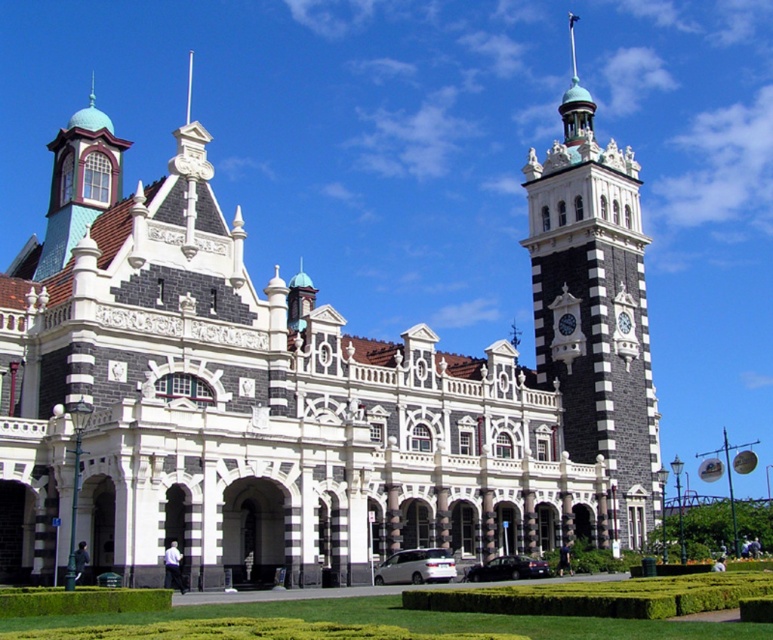
Question: Based on their relative distances, which object is nearer to the dark gray stone clock tower at center-right?

Choices:
 (A) white stone building at center
 (B) black glossy sedan at center

Answer: (B)

Question: Does white stone building at center appear under black glossy sedan at center?

Choices:
 (A) no
 (B) yes

Answer: (A)

Question: Which of these objects is positioned farthest from the white stone building at center?

Choices:
 (A) polished brass clock at center-right
 (B) white matte van at center

Answer: (A)

Question: Among these objects, which one is farthest from the camera?

Choices:
 (A) white matte van at center
 (B) polished brass clock at center-right
 (C) dark gray stone clock tower at upper right

Answer: (B)

Question: Can you confirm if dark gray stone clock tower at upper right is positioned above dark gray stone clock tower at center-right?

Choices:
 (A) yes
 (B) no

Answer: (A)

Question: Is white stone building at center positioned at the back of black glossy sedan at center?

Choices:
 (A) no
 (B) yes

Answer: (A)